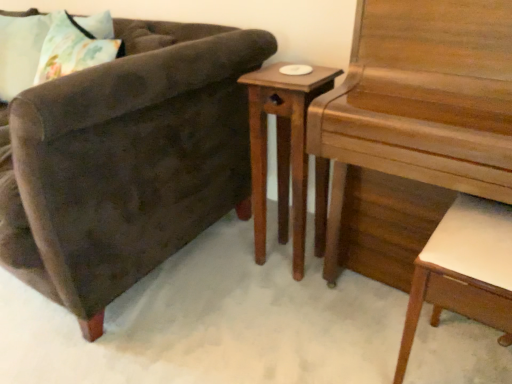
Measure the distance between fluffy fabric pillow at upper left and camera.

fluffy fabric pillow at upper left and camera are 1.43 meters apart from each other.

Image resolution: width=512 pixels, height=384 pixels. What do you see at coordinates (126, 161) in the screenshot?
I see `velvet brown armchair at left` at bounding box center [126, 161].

Find the location of `white leather desk at lower right`. white leather desk at lower right is located at coordinates (464, 271).

Image resolution: width=512 pixels, height=384 pixels. Identify the location of fluffy fabric pillow at upper left. (51, 48).

From a real-world perspective, relative to white leather desk at lower right, is wooden nightstand at center vertically above or below?

In terms of real-world spatial position, wooden nightstand at center is above white leather desk at lower right.

Is wooden nightstand at center wider than white leather desk at lower right?

In fact, wooden nightstand at center might be narrower than white leather desk at lower right.

Based on the photo, can you confirm if wooden nightstand at center is bigger than white leather desk at lower right?

Correct, wooden nightstand at center is larger in size than white leather desk at lower right.

At what (x,y) coordinates should I click in order to perform the action: click on desk below the wooden nightstand at center (from the image's perspective). Please return your answer as a coordinate pair (x, y). The image size is (512, 384). Looking at the image, I should click on (464, 271).

Looking at this image, can you confirm if white leather desk at lower right is wider than velvet brown armchair at left?

No, white leather desk at lower right is not wider than velvet brown armchair at left.

This screenshot has width=512, height=384. Find the location of `desk below the velvet brown armchair at left (from the image's perspective)`. desk below the velvet brown armchair at left (from the image's perspective) is located at coordinates (464, 271).

Could you tell me if white leather desk at lower right is facing velvet brown armchair at left?

No, white leather desk at lower right is not turned towards velvet brown armchair at left.

Consider the image. Can you confirm if white leather desk at lower right is taller than velvet brown armchair at left?

No.

Considering the sizes of objects white leather desk at lower right and wooden nightstand at center in the image provided, who is shorter, white leather desk at lower right or wooden nightstand at center?

With less height is white leather desk at lower right.

From the image's perspective, is white leather desk at lower right above wooden nightstand at center?

Incorrect, from the image's perspective, white leather desk at lower right is lower than wooden nightstand at center.

Considering the sizes of objects white leather desk at lower right and wooden nightstand at center in the image provided, who is wider, white leather desk at lower right or wooden nightstand at center?

white leather desk at lower right.

Considering the points (297, 86) and (21, 98), which point is behind, point (297, 86) or point (21, 98)?

The point (297, 86) is more distant.

Considering the sizes of objects wooden nightstand at center and velvet brown armchair at left in the image provided, who is taller, wooden nightstand at center or velvet brown armchair at left?

With more height is velvet brown armchair at left.

Is wooden nightstand at center not near velvet brown armchair at left?

No, wooden nightstand at center is not far from velvet brown armchair at left.

Does wooden nightstand at center contain velvet brown armchair at left?

No, wooden nightstand at center does not contain velvet brown armchair at left.

Is white leather desk at lower right in front of or behind fluffy fabric pillow at upper left in the image?

white leather desk at lower right is positioned closer to the viewer than fluffy fabric pillow at upper left.

From the image's perspective, relative to fluffy fabric pillow at upper left, is white leather desk at lower right above or below?

From the image's perspective, white leather desk at lower right appears below fluffy fabric pillow at upper left.

Is white leather desk at lower right smaller than fluffy fabric pillow at upper left?

No.

Find the location of a particular element. pillow that appears above the white leather desk at lower right (from the image's perspective) is located at coordinates (51, 48).

From a real-world perspective, does wooden nightstand at center sit lower than wooden piano at right?

Correct, in the physical world, wooden nightstand at center is lower than wooden piano at right.

In the scene shown: Which of these two, wooden nightstand at center or wooden piano at right, stands shorter?

wooden nightstand at center is shorter.

Can we say wooden nightstand at center lies outside wooden piano at right?

Absolutely, wooden nightstand at center is external to wooden piano at right.

Who is smaller, velvet brown armchair at left or wooden nightstand at center?

With smaller size is wooden nightstand at center.

Is wooden nightstand at center inside velvet brown armchair at left?

No, wooden nightstand at center is not inside velvet brown armchair at left.

Could you tell me if velvet brown armchair at left is facing wooden nightstand at center?

No, velvet brown armchair at left is not oriented towards wooden nightstand at center.

Where is `desk below the wooden nightstand at center (from a real-world perspective)`? desk below the wooden nightstand at center (from a real-world perspective) is located at coordinates (464, 271).

Where is `desk lying in front of the velvet brown armchair at left`? desk lying in front of the velvet brown armchair at left is located at coordinates click(464, 271).

When comparing their distances from velvet brown armchair at left, does wooden nightstand at center or fluffy fabric pillow at upper left seem closer?

The object closer to velvet brown armchair at left is wooden nightstand at center.

Based on their spatial positions, is white leather desk at lower right or wooden piano at right further from wooden nightstand at center?

Among the two, white leather desk at lower right is located further to wooden nightstand at center.

When comparing their distances from wooden nightstand at center, does fluffy fabric pillow at upper left or velvet brown armchair at left seem closer?

The object closer to wooden nightstand at center is velvet brown armchair at left.

Considering their positions, is wooden piano at right positioned closer to fluffy fabric pillow at upper left than white leather desk at lower right?

wooden piano at right is positioned closer to the anchor fluffy fabric pillow at upper left.

When comparing their distances from fluffy fabric pillow at upper left, does white leather desk at lower right or wooden piano at right seem closer?

The object closer to fluffy fabric pillow at upper left is wooden piano at right.

When comparing their distances from wooden piano at right, does wooden nightstand at center or velvet brown armchair at left seem closer?

Among the two, wooden nightstand at center is located nearer to wooden piano at right.

Estimate the real-world distances between objects in this image. Which object is further from wooden nightstand at center, fluffy fabric pillow at upper left or wooden piano at right?

fluffy fabric pillow at upper left lies further to wooden nightstand at center than the other object.

Consider the image. Looking at the image, which one is located closer to fluffy fabric pillow at upper left, velvet brown armchair at left or white leather desk at lower right?

Among the two, velvet brown armchair at left is located nearer to fluffy fabric pillow at upper left.

At what (x,y) coordinates should I click in order to perform the action: click on piano located between velvet brown armchair at left and white leather desk at lower right in the left-right direction. Please return your answer as a coordinate pair (x, y). Looking at the image, I should click on (414, 123).

Identify the location of nightstand located between fluffy fabric pillow at upper left and wooden piano at right in the left-right direction. The width and height of the screenshot is (512, 384). (282, 149).

Where is `pillow situated between velvet brown armchair at left and wooden piano at right from left to right`? The image size is (512, 384). pillow situated between velvet brown armchair at left and wooden piano at right from left to right is located at coordinates (51, 48).

Where is `piano between fluffy fabric pillow at upper left and white leather desk at lower right in the horizontal direction`? The image size is (512, 384). piano between fluffy fabric pillow at upper left and white leather desk at lower right in the horizontal direction is located at coordinates (414, 123).